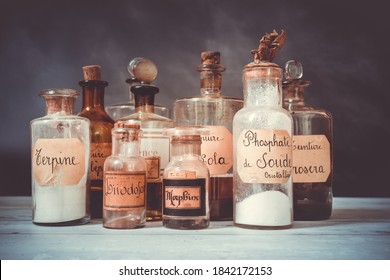
Find the location of a particular element. The width and height of the screenshot is (390, 280). countertop is located at coordinates (223, 240).